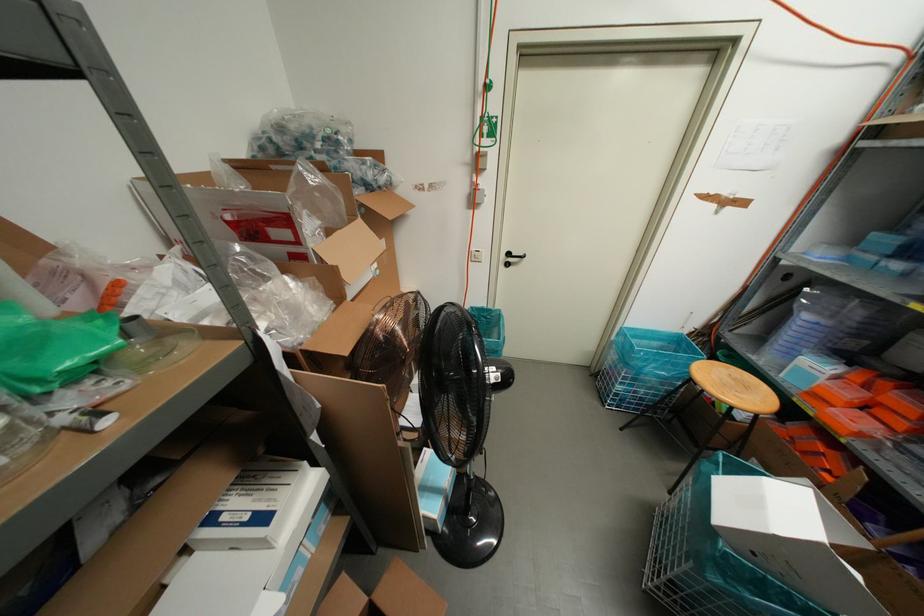
Identify the location of stool sitting surface. This screenshot has width=924, height=616. (734, 387).